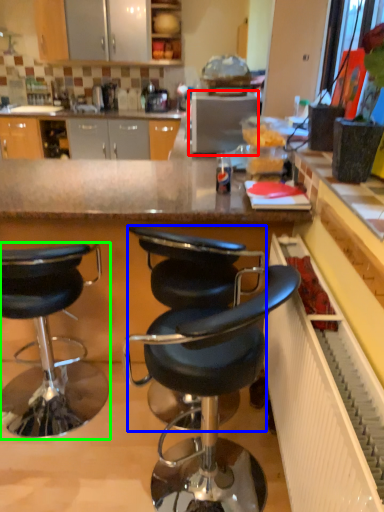
Question: Estimate the real-world distances between objects in this image. Which object is closer to appliance (highlighted by a red box), chair (highlighted by a blue box) or chair (highlighted by a green box)?

Choices:
 (A) chair
 (B) chair

Answer: (A)